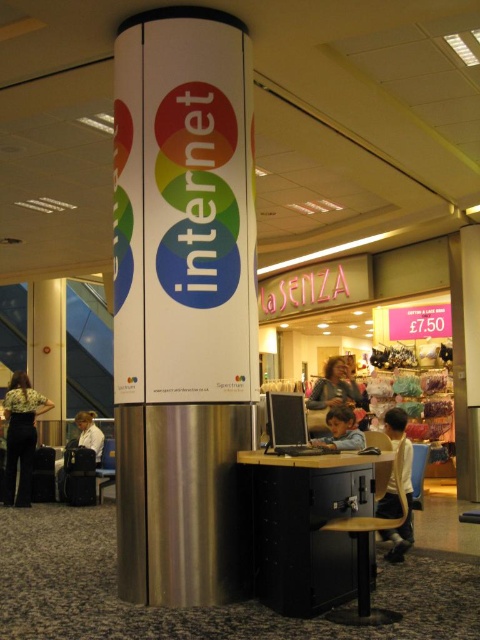
Based on the photo, you are setting up a new computer workstation in the mall. You have a black metal cabinet at lower center and a black glossy monitor at center. Which object is taller?

The black metal cabinet at lower center is taller than the black glossy monitor at center.

You are organizing a small event in the space shown. You need to place a 1.2 meter wide banner between the floral blouse at lower left and the light brown wooden desk at center. Is there enough space?

The floral blouse at lower left might be wider than light brown wooden desk at center, so the total width required for the banner may exceed 1.2 meters. It is uncertain if there is enough space without knowing the exact dimensions of both objects.